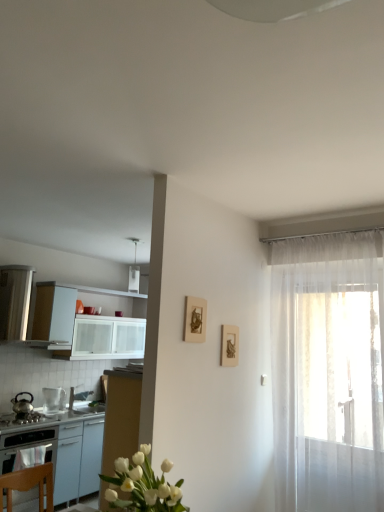
Where is `white glossy table at left`? white glossy table at left is located at coordinates (60, 448).

This screenshot has width=384, height=512. What do you see at coordinates (22, 403) in the screenshot?
I see `shiny metallic kettle at left, which ranks as the second kitchen appliance in right-to-left order` at bounding box center [22, 403].

Locate an element on the screen. white glossy table at left is located at coordinates (60, 448).

Considering the points (49, 333) and (61, 480), which point is behind, point (49, 333) or point (61, 480)?

The point (49, 333) is behind.

Would you say white glossy cabinet at left contains white glossy table at left?

Actually, white glossy table at left is outside white glossy cabinet at left.

How different are the orientations of white glossy cabinet at left and white glossy table at left in degrees?

The angular difference between white glossy cabinet at left and white glossy table at left is 0.23 degrees.

Is white glossy sink at lower left turned away from wooden picture frame at center-right, placed as the 2th picture frame when sorted from left to right?

That's not correct — white glossy sink at lower left is not looking away from wooden picture frame at center-right, placed as the 2th picture frame when sorted from left to right.

Which is less distant, (97,406) or (224,330)?

Clearly, point (97,406) is more distant from the camera than point (224,330).

At what (x,y) coordinates should I click in order to perform the action: click on sink to the left of wooden picture frame at center-right, which is counted as the 2th picture frame, starting from the front. Please return your answer as a coordinate pair (x, y). The image size is (384, 512). Looking at the image, I should click on [x=84, y=402].

Is white glossy sink at lower left positioned before wooden picture frame at center-right, which ranks as the first picture frame in right-to-left order?

No, it is behind wooden picture frame at center-right, which ranks as the first picture frame in right-to-left order.

From the picture: What's the angular difference between shiny metallic kettle at left, which ranks as the second kitchen appliance in right-to-left order, and white glossy table at left's facing directions?

132 degrees separate the facing orientations of shiny metallic kettle at left, which ranks as the second kitchen appliance in right-to-left order, and white glossy table at left.

In the scene shown: Is white glossy table at left located within shiny metallic kettle at left, marked as the 1th kitchen appliance in a left-to-right arrangement?

No.

Who is taller, shiny metallic kettle at left, which ranks as the second kitchen appliance in right-to-left order, or white glossy table at left?

white glossy table at left is taller.

Is the position of shiny metallic kettle at left, which ranks as the second kitchen appliance in right-to-left order, less distant than that of white glossy table at left?

No.

From the image's perspective, which is below, white glossy cabinet at left or translucent white curtain at right?

translucent white curtain at right, from the image's perspective.

Can you confirm if white glossy cabinet at left is wider than translucent white curtain at right?

Indeed, white glossy cabinet at left has a greater width compared to translucent white curtain at right.

Based on the photo, from a real-world perspective, between white glossy cabinet at left and translucent white curtain at right, who is vertically higher?

white glossy cabinet at left.

Which point is more forward, (221, 361) or (99, 334)?

Positioned in front is point (221, 361).

Considering the sizes of objects wooden picture frame at center-right, which ranks as the first picture frame in right-to-left order, and white glossy cabinet at left in the image provided, who is thinner, wooden picture frame at center-right, which ranks as the first picture frame in right-to-left order, or white glossy cabinet at left?

wooden picture frame at center-right, which ranks as the first picture frame in right-to-left order, is thinner.

Is wooden picture frame at center-right, placed as the 2th picture frame when sorted from left to right, turned away from white glossy cabinet at left?

That's not correct — wooden picture frame at center-right, placed as the 2th picture frame when sorted from left to right, is not looking away from white glossy cabinet at left.

From the image's perspective, is wooden picture frame at center-right, positioned as the first picture frame in back-to-front order, located above or below white glossy cabinet at left?

wooden picture frame at center-right, positioned as the first picture frame in back-to-front order, is above white glossy cabinet at left.

Can you confirm if matte gold picture frame at upper center, arranged as the 2th picture frame when viewed from the right, is smaller than translucent white curtain at right?

Correct, matte gold picture frame at upper center, arranged as the 2th picture frame when viewed from the right, occupies less space than translucent white curtain at right.

Which is behind, matte gold picture frame at upper center, arranged as the first picture frame when viewed from the left, or translucent white curtain at right?

translucent white curtain at right is further away from the camera.

Consider the image. How much distance is there between matte gold picture frame at upper center, the second picture frame from the back, and translucent white curtain at right?

matte gold picture frame at upper center, the second picture frame from the back, and translucent white curtain at right are 3.50 feet apart from each other.

Based on the photo, is wooden picture frame at center-right, which is counted as the 2th picture frame, starting from the front, far away from white glossy sink at lower left?

Indeed, wooden picture frame at center-right, which is counted as the 2th picture frame, starting from the front, is not near white glossy sink at lower left.

Is wooden picture frame at center-right, placed as the 2th picture frame when sorted from left to right, not within white glossy sink at lower left?

Yes, wooden picture frame at center-right, placed as the 2th picture frame when sorted from left to right, is not within white glossy sink at lower left.

How different are the orientations of wooden picture frame at center-right, which ranks as the first picture frame in right-to-left order, and white glossy sink at lower left in degrees?

There is a 1.67-degree angle between the facing directions of wooden picture frame at center-right, which ranks as the first picture frame in right-to-left order, and white glossy sink at lower left.

The image size is (384, 512). I want to click on sink behind the wooden picture frame at center-right, which ranks as the first picture frame in right-to-left order, so click(84, 402).

Locate an element on the screen. table below the white glossy cabinet at left (from a real-world perspective) is located at coordinates (60, 448).

Starting from the white glossy sink at lower left, which picture frame is the 2nd one to the right? Please provide its 2D coordinates.

[(229, 345)]

When comparing their distances from white glossy sink at lower left, does translucent white curtain at right or wooden picture frame at center-right, positioned as the first picture frame in back-to-front order, seem closer?

wooden picture frame at center-right, positioned as the first picture frame in back-to-front order.

Looking at the image, which one is located closer to shiny metallic kettle at left, which ranks as the second kitchen appliance in right-to-left order, clear glass pitcher at left, which appears as the 2th kitchen appliance when viewed from the left, or wooden picture frame at center-right, which ranks as the first picture frame in right-to-left order?

Among the two, clear glass pitcher at left, which appears as the 2th kitchen appliance when viewed from the left, is located nearer to shiny metallic kettle at left, which ranks as the second kitchen appliance in right-to-left order.

From the image, which object appears to be farther from clear glass pitcher at left, the 1th kitchen appliance when ordered from right to left, wooden picture frame at center-right, positioned as the first picture frame in back-to-front order, or white glossy cabinet at left?

wooden picture frame at center-right, positioned as the first picture frame in back-to-front order, lies further to clear glass pitcher at left, the 1th kitchen appliance when ordered from right to left, than the other object.

Based on their spatial positions, is white glossy cabinet at left or white glossy sink at lower left closer to matte gold picture frame at upper center, arranged as the 2th picture frame when viewed from the right?

white glossy cabinet at left is closer to matte gold picture frame at upper center, arranged as the 2th picture frame when viewed from the right.

Estimate the real-world distances between objects in this image. Which object is further from shiny metallic kettle at left, marked as the 1th kitchen appliance in a left-to-right arrangement, white glossy table at left or translucent white curtain at right?

translucent white curtain at right lies further to shiny metallic kettle at left, marked as the 1th kitchen appliance in a left-to-right arrangement, than the other object.

From the image, which object appears to be nearer to wooden picture frame at center-right, which ranks as the first picture frame in right-to-left order, matte gold picture frame at upper center, arranged as the first picture frame when viewed from the left, or white glossy cabinet at left?

matte gold picture frame at upper center, arranged as the first picture frame when viewed from the left.

From the image, which object appears to be nearer to white glossy sink at lower left, wooden picture frame at center-right, placed as the 2th picture frame when sorted from left to right, or shiny metallic kettle at left, which ranks as the second kitchen appliance in right-to-left order?

Based on the image, shiny metallic kettle at left, which ranks as the second kitchen appliance in right-to-left order, appears to be nearer to white glossy sink at lower left.

Based on their spatial positions, is matte gold picture frame at upper center, arranged as the 2th picture frame when viewed from the right, or white glossy sink at lower left closer to clear glass pitcher at left, which appears as the 2th kitchen appliance when viewed from the left?

white glossy sink at lower left.

What are the coordinates of `cabinetry between shiny metallic kettle at left, which ranks as the second kitchen appliance in right-to-left order, and wooden picture frame at center-right, placed as the 2th picture frame when sorted from left to right` in the screenshot? It's located at (85, 326).

Locate an element on the screen. picture frame between matte gold picture frame at upper center, arranged as the first picture frame when viewed from the left, and white glossy table at left vertically is located at coordinates (229, 345).

Identify the location of cabinetry between wooden picture frame at center-right, which is counted as the 2th picture frame, starting from the front, and white glossy sink at lower left in the front-back direction. (85, 326).

Locate an element on the screen. The height and width of the screenshot is (512, 384). sink between clear glass pitcher at left, the 1th kitchen appliance when ordered from right to left, and translucent white curtain at right, in the horizontal direction is located at coordinates (84, 402).